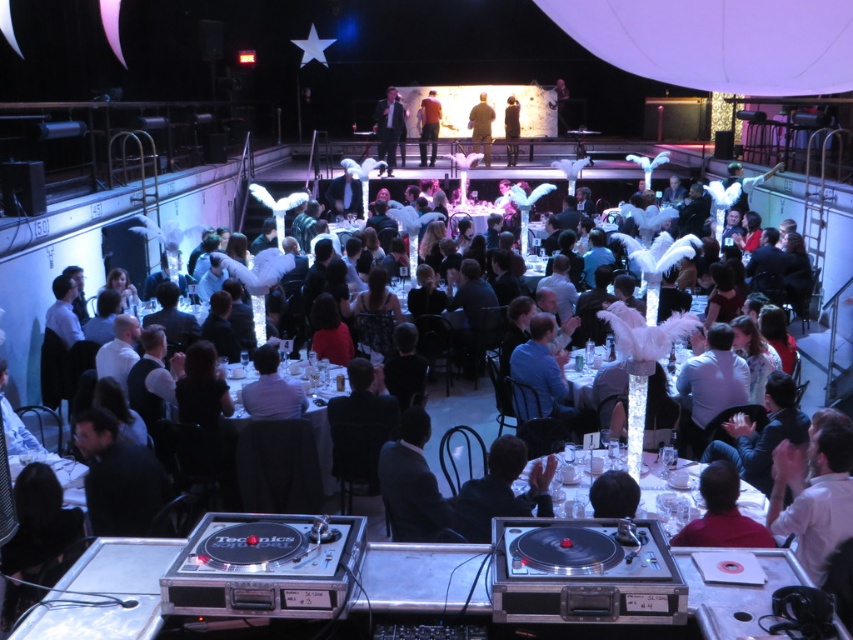
You are standing at the DJ booth and want to move towards the point marked as point (527, 467). However, there is an obstacle at point (277, 406). Will you encounter the obstacle before reaching your destination?

Yes, you will encounter the obstacle at point (277, 406) before reaching point (527, 467) because point (277, 406) is closer to the DJ booth than point (527, 467).

You are a photographer at the event and need to take a group photo of the black leather jacket at center and the khaki fabric jacket at center. Which jacket should you position closer to the camera to ensure both appear equally tall in the photo?

To make both jackets appear equally tall in the photo, position the black leather jacket at center closer to the camera since it has a lesser height compared to the khaki fabric jacket at center.

You are a photographer at the event and need to capture a photo that includes both the matte black suit at upper center and the white feathered centerpiece at center. Which object should you frame first to ensure both fit in the shot?

The matte black suit at upper center is wider than the white feathered centerpiece at center, so you should frame the matte black suit at upper center first to accommodate its larger width in the shot.